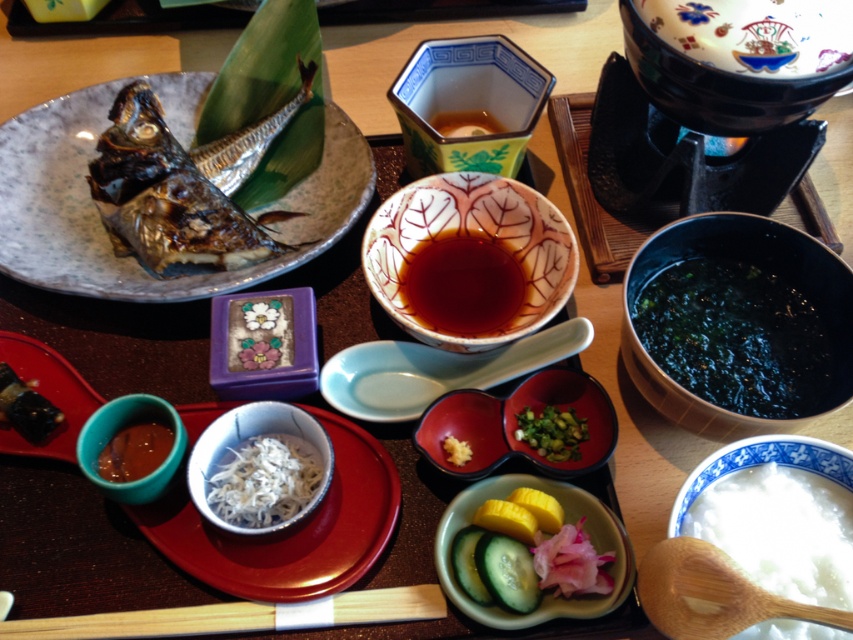
Question: Is dark green seaweed at lower right closer to the viewer compared to green leafy garnish at center?

Choices:
 (A) yes
 (B) no

Answer: (A)

Question: Which point is farther to the camera?

Choices:
 (A) coord(1,413)
 (B) coord(477,419)

Answer: (B)

Question: Can you confirm if wooden chopsticks at lower center is bigger than slightly glossy brown sauce at lower left?

Choices:
 (A) yes
 (B) no

Answer: (A)

Question: Which object is farther from the camera taking this photo?

Choices:
 (A) white shredded fish at center
 (B) sliced cucumber at center

Answer: (A)

Question: Estimate the real-world distances between objects in this image. Which object is closer to the white porcelain rice bowl at lower right?

Choices:
 (A) porcelain bowl at upper right
 (B) slightly glossy brown sauce at lower left
 (C) porcelain hexagonal bowl at upper center

Answer: (A)

Question: Does wooden chopsticks at lower center lie behind slightly glossy brown sauce at lower left?

Choices:
 (A) no
 (B) yes

Answer: (A)